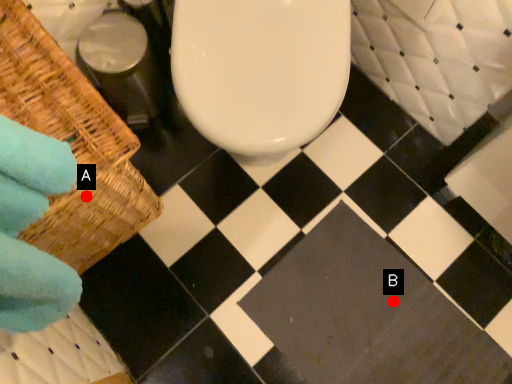
Question: Two points are circled on the image, labeled by A and B beside each circle. Which point is farther from the camera taking this photo?

Choices:
 (A) A is further
 (B) B is further

Answer: (B)